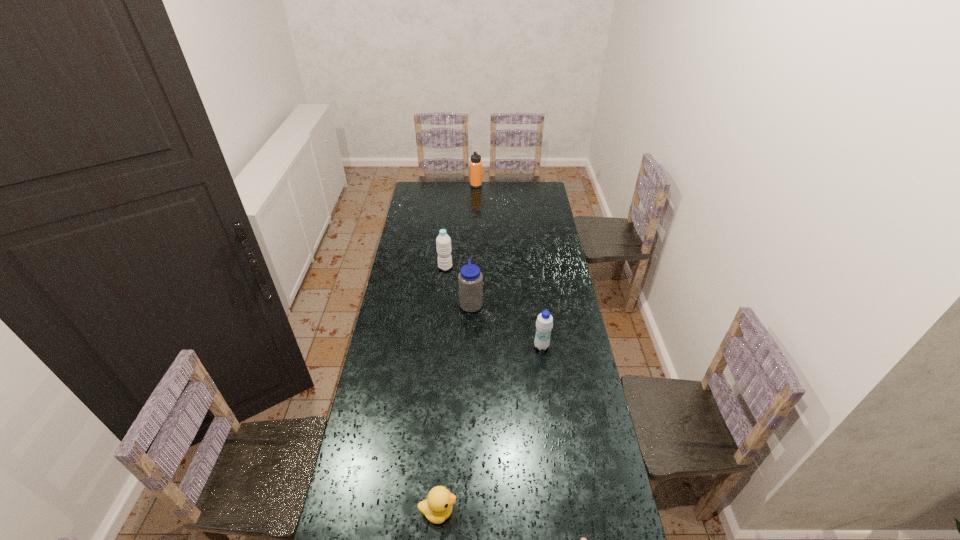
Locate an element on the screen. Image resolution: width=960 pixels, height=540 pixels. free space between the duck and the nearest water bottle is located at coordinates (490, 429).

Identify the location of vacant space that is in between the fifth nearest object and the farthest object. (461, 226).

I want to click on object that can be found as the fourth closest to the nearest object, so click(x=443, y=242).

Identify which object is located as the nearest to the farthest object. Please provide its 2D coordinates. Your answer should be formatted as a tuple, i.e. [(x, y)], where the tuple contains the x and y coordinates of a point satisfying the conditions above.

[(443, 242)]

You are a GUI agent. You are given a task and a screenshot of the screen. Output one action in this format:
    pyautogui.click(x=<x>, y=<y>)
    Task: Click on the water bottle that is the second closest to the nearest water bottle
    The width and height of the screenshot is (960, 540).
    Given the screenshot: What is the action you would take?
    pyautogui.click(x=443, y=242)

Identify which water bottle is the second nearest to the farthest object. Please provide its 2D coordinates. Your answer should be formatted as a tuple, i.e. [(x, y)], where the tuple contains the x and y coordinates of a point satisfying the conditions above.

[(470, 280)]

Find the location of a particular element. This screenshot has height=540, width=960. vacant region that satisfies the following two spatial constraints: 1. with a carrying loop on the side of the nearest water bottle; 2. on the right side of the second nearest water bottle is located at coordinates (470, 346).

Where is `vacant space that satisfies the following two spatial constraints: 1. with a carrying loop on the side of the nearest water bottle; 2. on the right side of the second water bottle from left to right`? This screenshot has width=960, height=540. vacant space that satisfies the following two spatial constraints: 1. with a carrying loop on the side of the nearest water bottle; 2. on the right side of the second water bottle from left to right is located at coordinates (470, 346).

This screenshot has width=960, height=540. I want to click on free space that satisfies the following two spatial constraints: 1. with a carrying loop on the side of the second water bottle from right to left; 2. on the right side of the third nearest object, so click(x=470, y=346).